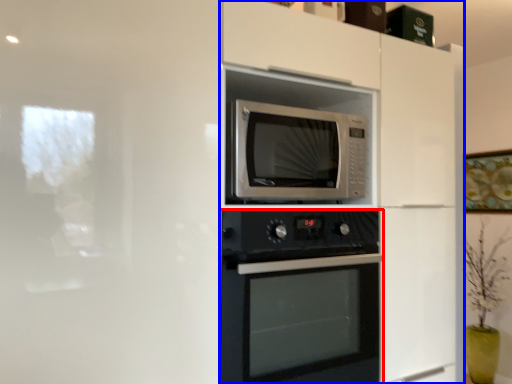
Question: Which point is further to the camera, oven (highlighted by a red box) or dresser (highlighted by a blue box)?

Choices:
 (A) oven
 (B) dresser

Answer: (A)